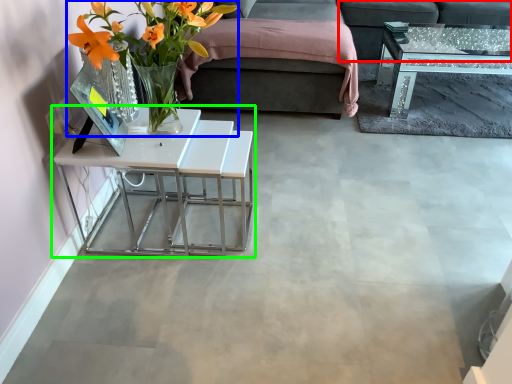
Question: Considering the real-world distances, which object is farthest from couch (highlighted by a red box)? floral arrangement (highlighted by a blue box) or table (highlighted by a green box)?

Choices:
 (A) floral arrangement
 (B) table

Answer: (A)